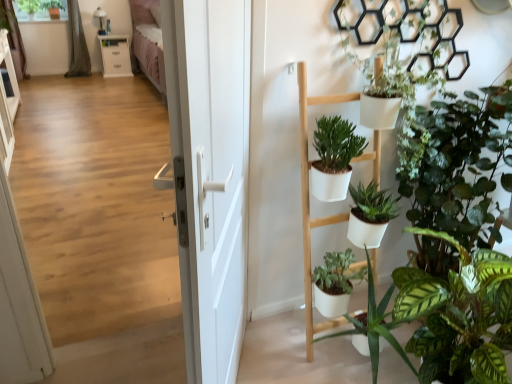
You are a GUI agent. You are given a task and a screenshot of the screen. Output one action in this format:
    pyautogui.click(x=<x>, y=<y>)
    Task: Click on the unoccupied space behind wooden floor at center
    The image size is (512, 384).
    Given the screenshot: What is the action you would take?
    pyautogui.click(x=136, y=301)